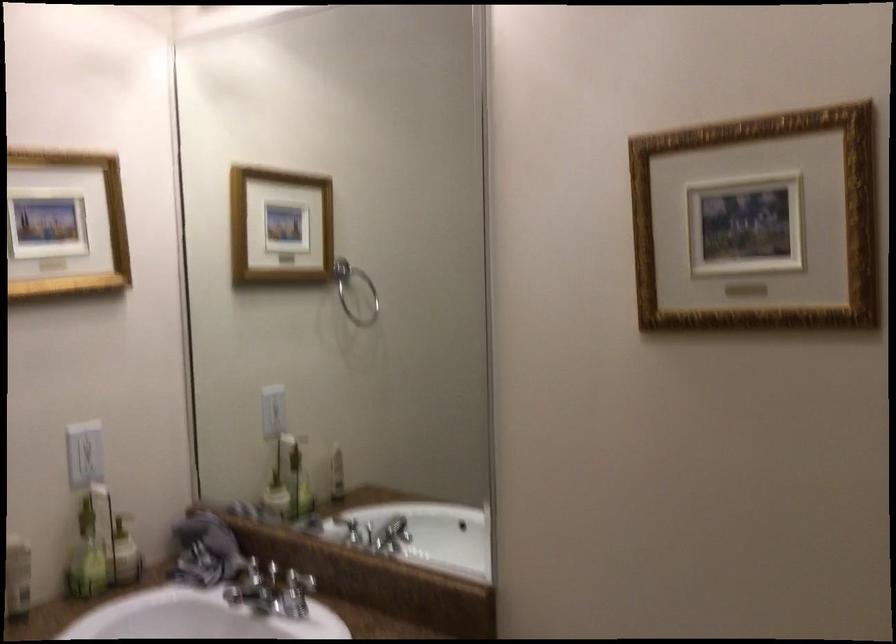
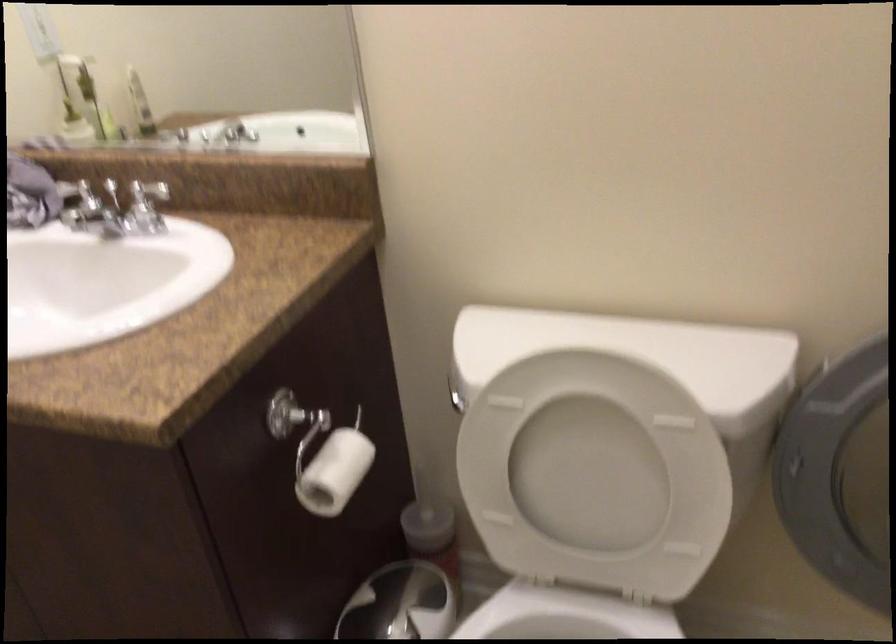
In the second image, find the point that corresponds to [277,474] in the first image.

(70, 111)